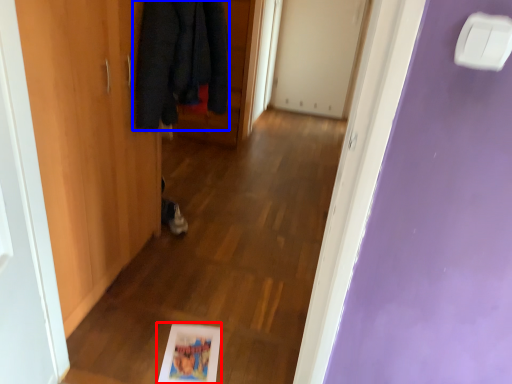
Question: Which point is closer to the camera, picture frame (highlighted by a red box) or cloak (highlighted by a blue box)?

Choices:
 (A) picture frame
 (B) cloak

Answer: (B)